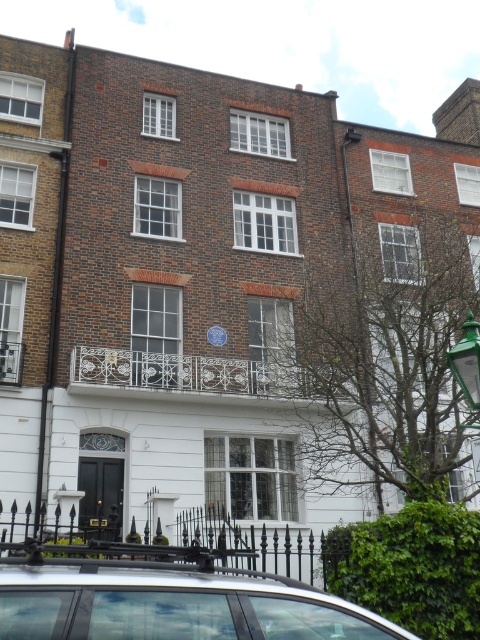
Question: Does silver metallic car at lower left lie in front of green glass lamp post at right?

Choices:
 (A) no
 (B) yes

Answer: (B)

Question: Which object is farther from the camera taking this photo?

Choices:
 (A) silver metallic car at lower left
 (B) green glass lamp post at right

Answer: (B)

Question: Does silver metallic car at lower left have a smaller size compared to green glass lamp post at right?

Choices:
 (A) yes
 (B) no

Answer: (A)

Question: Can you confirm if silver metallic car at lower left is positioned to the right of green glass lamp post at right?

Choices:
 (A) no
 (B) yes

Answer: (A)